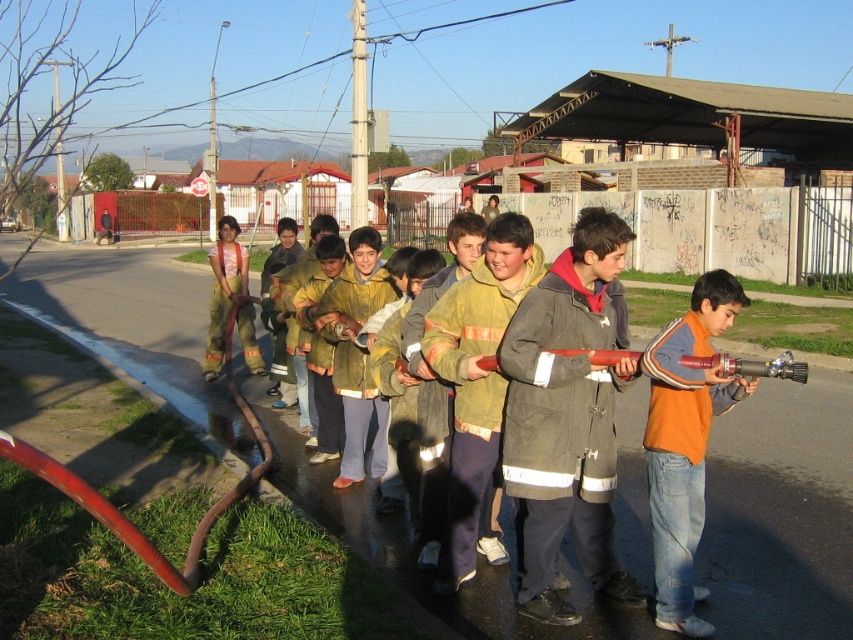
Which is more to the right, olive-green canvas jacket at center or yellow fabric jacket at center?

From the viewer's perspective, olive-green canvas jacket at center appears more on the right side.

Does olive-green canvas jacket at center appear on the right side of yellow fabric jacket at center?

Correct, you'll find olive-green canvas jacket at center to the right of yellow fabric jacket at center.

Between point (561, 612) and point (358, 403), which one is positioned behind?

The point (358, 403) is more distant.

Locate an element on the screen. The width and height of the screenshot is (853, 640). olive-green canvas jacket at center is located at coordinates (567, 417).

Between point (686, 445) and point (355, 292), which one is positioned behind?

Positioned behind is point (355, 292).

Which is above, orange fleece jacket at center or yellow fabric jacket at center?

yellow fabric jacket at center is higher up.

You are a GUI agent. You are given a task and a screenshot of the screen. Output one action in this format:
    pyautogui.click(x=<x>, y=<y>)
    Task: Click on the orange fleece jacket at center
    The width and height of the screenshot is (853, 640).
    Given the screenshot: What is the action you would take?
    pyautogui.click(x=685, y=442)

Based on the photo, is olive-green canvas jacket at center smaller than yellow fire jacket at center?

No, olive-green canvas jacket at center is not smaller than yellow fire jacket at center.

Where is `olive-green canvas jacket at center`? olive-green canvas jacket at center is located at coordinates pyautogui.click(x=567, y=417).

This screenshot has width=853, height=640. In order to click on olive-green canvas jacket at center in this screenshot , I will do `click(567, 417)`.